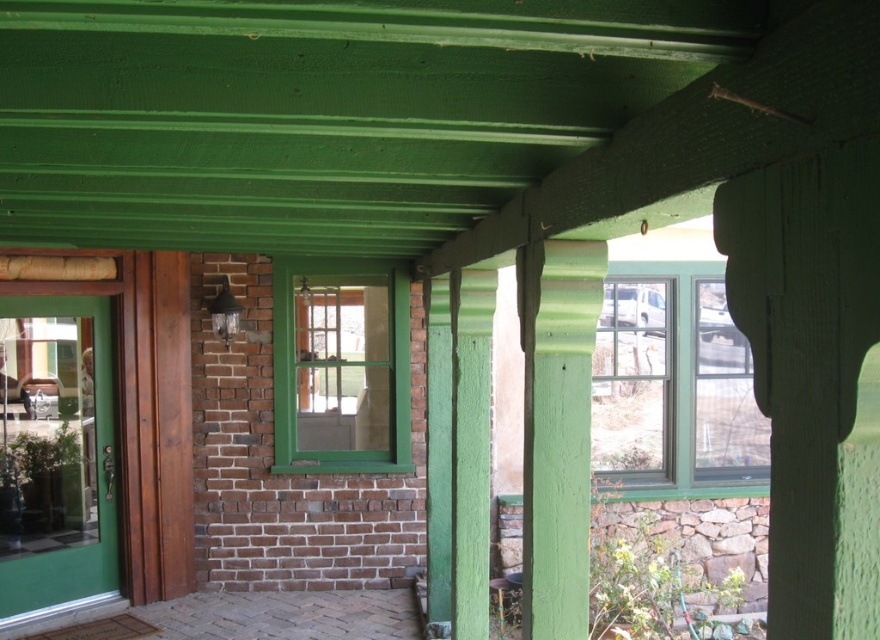
Which of these two, green painted wood window at center or green painted wood at center, stands taller?

Standing taller between the two is green painted wood window at center.

Can you confirm if green painted wood window at center is positioned to the left of green painted wood at center?

Correct, you'll find green painted wood window at center to the left of green painted wood at center.

Describe the element at coordinates (341, 368) in the screenshot. The image size is (880, 640). I see `green painted wood window at center` at that location.

Where is `green painted wood window at center`? This screenshot has width=880, height=640. green painted wood window at center is located at coordinates (341, 368).

You are a GUI agent. You are given a task and a screenshot of the screen. Output one action in this format:
    pyautogui.click(x=<x>, y=<y>)
    Task: Click on the clear glass door at left
    This screenshot has width=880, height=640.
    Given the screenshot: What is the action you would take?
    pyautogui.click(x=55, y=452)

At what (x,y) coordinates should I click in order to perform the action: click on clear glass door at left. Please return your answer as a coordinate pair (x, y). Image resolution: width=880 pixels, height=640 pixels. Looking at the image, I should click on (55, 452).

Which is more to the left, clear glass door at left or green painted wood at center?

From the viewer's perspective, clear glass door at left appears more on the left side.

Find the location of a particular element. The height and width of the screenshot is (640, 880). clear glass door at left is located at coordinates (55, 452).

The width and height of the screenshot is (880, 640). I want to click on clear glass door at left, so click(x=55, y=452).